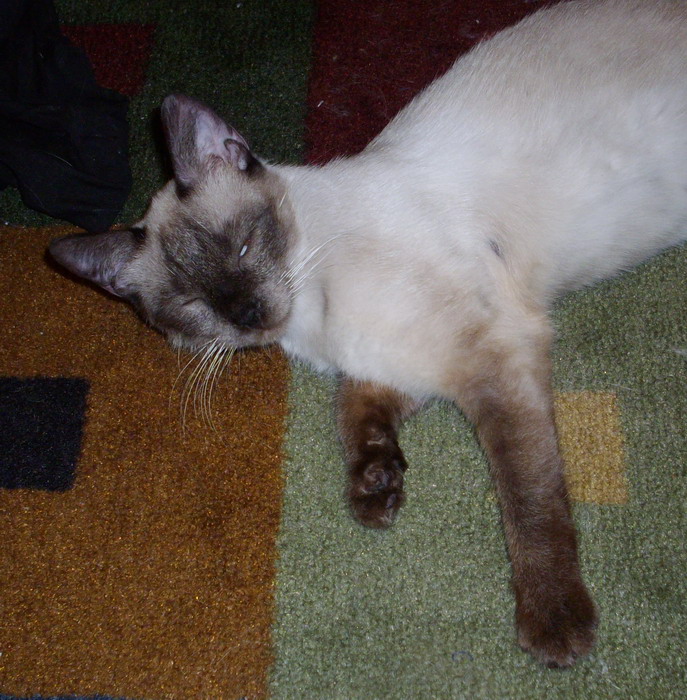
Identify the location of brown spot on green rug. (578, 449).